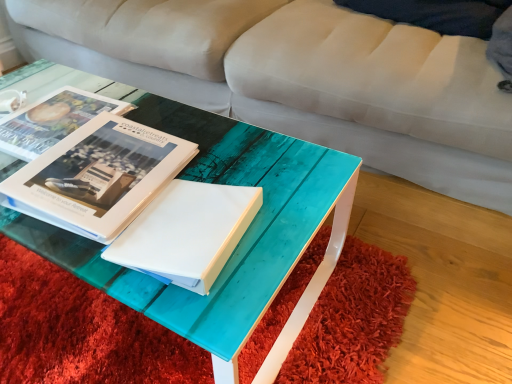
Question: From a real-world perspective, is matte white book at center, which appears as the second book when viewed from the back, located beneath translucent teal table at center?

Choices:
 (A) yes
 (B) no

Answer: (B)

Question: Is matte white book at center, which appears as the second book when viewed from the back, next to translucent teal table at center and touching it?

Choices:
 (A) yes
 (B) no

Answer: (B)

Question: Does matte white book at center, marked as the first book in a front-to-back arrangement, have a greater height compared to translucent teal table at center?

Choices:
 (A) no
 (B) yes

Answer: (B)

Question: From the image's perspective, is matte white book at center, which appears as the second book when viewed from the back, above translucent teal table at center?

Choices:
 (A) yes
 (B) no

Answer: (A)

Question: Is matte white book at center, which appears as the second book when viewed from the back, wider than translucent teal table at center?

Choices:
 (A) no
 (B) yes

Answer: (A)

Question: Relative to matte white book at center, marked as the first book in a front-to-back arrangement, is white matte paper at center in front or behind?

Choices:
 (A) behind
 (B) front

Answer: (B)

Question: Considering the positions of white matte paper at center and matte white book at center, which appears as the second book when viewed from the back, in the image, is white matte paper at center bigger or smaller than matte white book at center, which appears as the second book when viewed from the back,?

Choices:
 (A) small
 (B) big

Answer: (A)

Question: In the image, is white matte paper at center on the left side or the right side of matte white book at center, marked as the first book in a front-to-back arrangement?

Choices:
 (A) right
 (B) left

Answer: (A)

Question: Is white matte paper at center wider or thinner than matte white book at center, marked as the first book in a front-to-back arrangement?

Choices:
 (A) thin
 (B) wide

Answer: (A)

Question: Is translucent teal table at center taller or shorter than matte white book at center, the first book positioned from the back?

Choices:
 (A) tall
 (B) short

Answer: (A)

Question: Based on their positions, is translucent teal table at center located to the left or right of matte white book at center, the first book positioned from the back?

Choices:
 (A) left
 (B) right

Answer: (B)

Question: Is translucent teal table at center in front of or behind matte white book at center, which appears as the 2th book when viewed from the front, in the image?

Choices:
 (A) behind
 (B) front

Answer: (B)

Question: Looking at their shapes, would you say translucent teal table at center is wider or thinner than matte white book at center, which appears as the 2th book when viewed from the front?

Choices:
 (A) thin
 (B) wide

Answer: (B)

Question: Would you say matte white book at center, which appears as the 2th book when viewed from the front, is inside or outside white matte paper at center?

Choices:
 (A) outside
 (B) inside

Answer: (A)

Question: Visually, is matte white book at center, the first book positioned from the back, positioned to the left or to the right of white matte paper at center?

Choices:
 (A) right
 (B) left

Answer: (B)